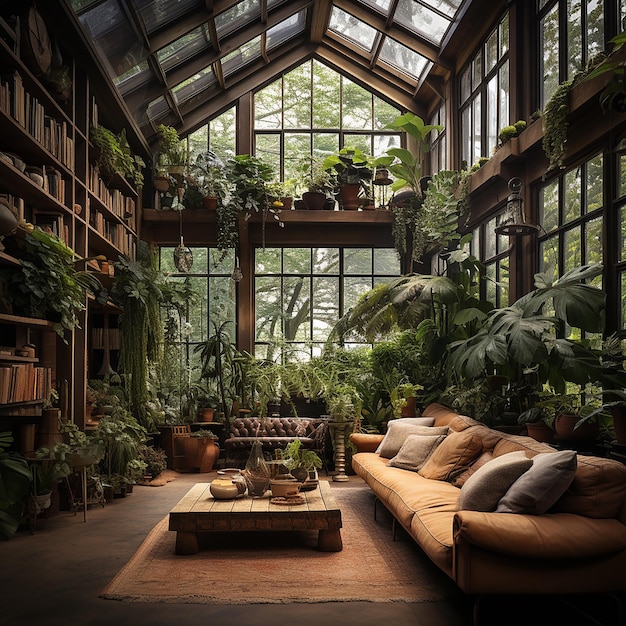
Locate an element on the screen. The width and height of the screenshot is (626, 626). cushions on couch is located at coordinates (535, 481), (498, 474), (476, 466), (456, 454), (416, 452), (393, 434).